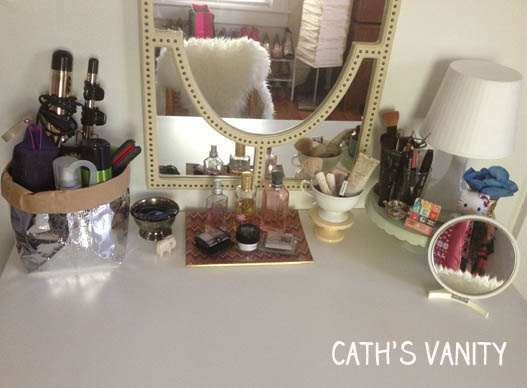
Locate an element on the screen. Image resolution: width=527 pixels, height=388 pixels. lampshade is located at coordinates (464, 119).